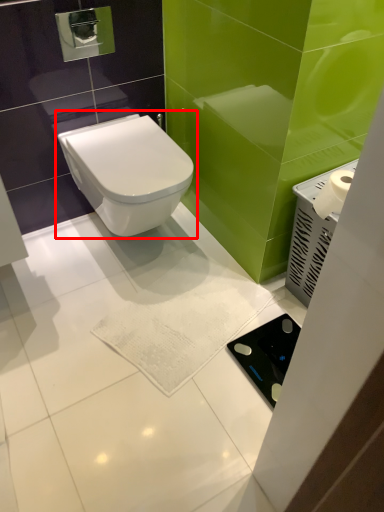
Question: Where is toilet (annotated by the red box) located in relation to appliance in the image?

Choices:
 (A) left
 (B) right

Answer: (A)